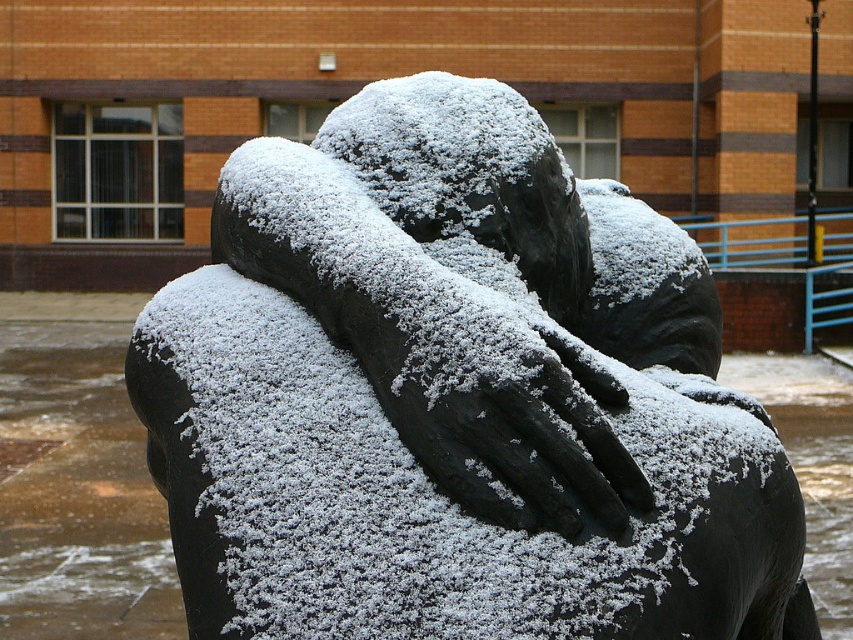
Question: Among these points, which one is farthest from the camera?

Choices:
 (A) (488, 481)
 (B) (401, 488)

Answer: (B)

Question: Does black matte statue at center appear on the left side of slick black hand at center?

Choices:
 (A) yes
 (B) no

Answer: (B)

Question: Observing the image, what is the correct spatial positioning of black matte statue at center in reference to slick black hand at center?

Choices:
 (A) left
 (B) right

Answer: (B)

Question: Which point is closer to the camera?

Choices:
 (A) black matte statue at center
 (B) slick black hand at center

Answer: (A)

Question: Which of the following is the farthest from the observer?

Choices:
 (A) slick black hand at center
 (B) black matte statue at center

Answer: (A)

Question: Is black matte statue at center below slick black hand at center?

Choices:
 (A) yes
 (B) no

Answer: (A)